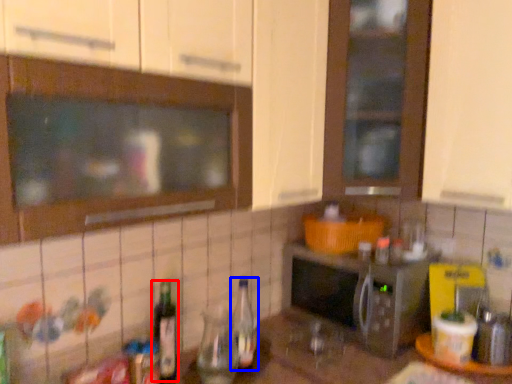
Question: Which point is closer to the camera, bottle (highlighted by a red box) or bottle (highlighted by a blue box)?

Choices:
 (A) bottle
 (B) bottle

Answer: (A)